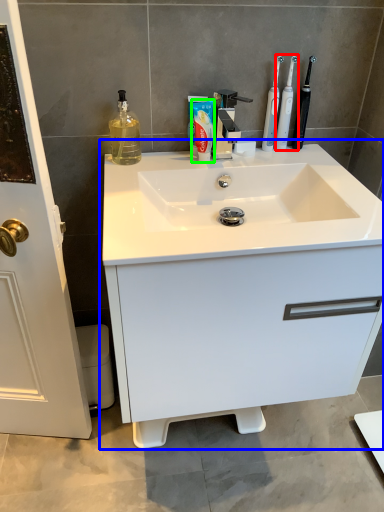
Question: Considering the real-world distances, which object is closest to toothbrush (highlighted by a red box)? bathroom cabinet (highlighted by a blue box) or shaving cream (highlighted by a green box).

Choices:
 (A) bathroom cabinet
 (B) shaving cream

Answer: (B)